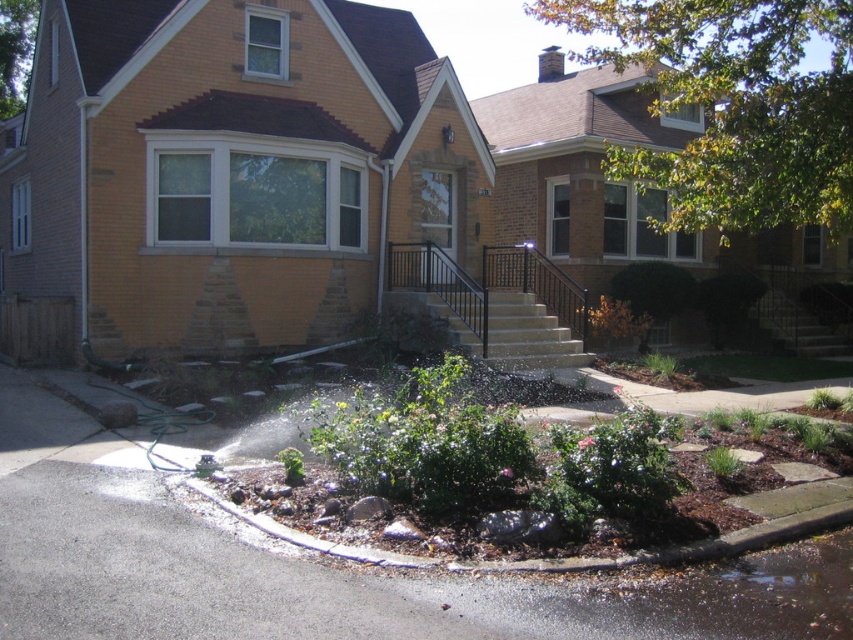
Question: From the image, what is the correct spatial relationship of light beige concrete stairs at center in relation to dark brown wooden stairs at center?

Choices:
 (A) right
 (B) left

Answer: (B)

Question: Is light beige concrete stairs at center behind dark brown wooden stairs at center?

Choices:
 (A) no
 (B) yes

Answer: (A)

Question: Is light beige concrete stairs at center positioned behind dark brown wooden stairs at center?

Choices:
 (A) yes
 (B) no

Answer: (B)